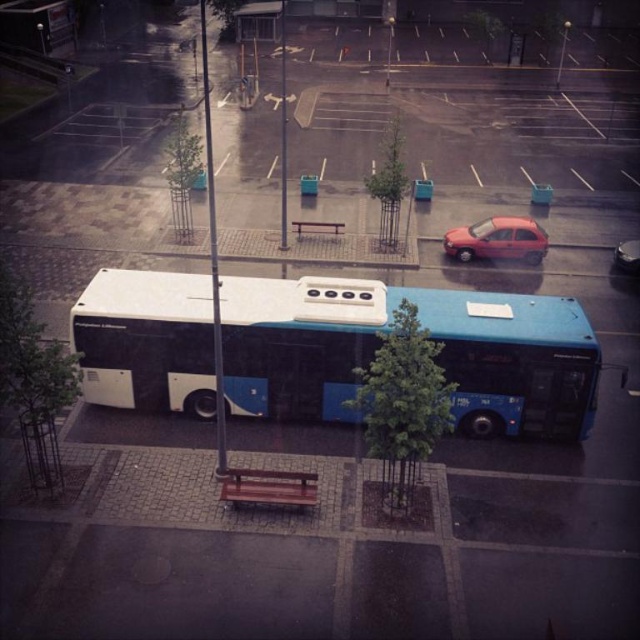
You are standing at the corner of the walkway and want to take a photo of the blue matte bus at center. Where should you position yourself to capture it in the frame?

The blue matte bus at center is located at point (429,337), so you should position yourself facing that coordinate to capture it in the frame.

You are a delivery person who needs to load a package onto the roof of the blue matte bus at center. There is a wooden park bench at center nearby. Can you safely place the package on the bus roof without the bench obstructing the process?

The blue matte bus at center is much taller than the wooden park bench at center, so the bench is unlikely to obstruct placing the package on the bus roof. However, ensure there is enough clearance around the bench to maneuver safely.

You are standing at the center of the walkway and want to take a photo of the shiny red car at center right. Where should you position yourself to capture it in the frame?

The shiny red car at center right is located at coordinates point (497,241), so you should position yourself facing that direction to capture it in the frame.